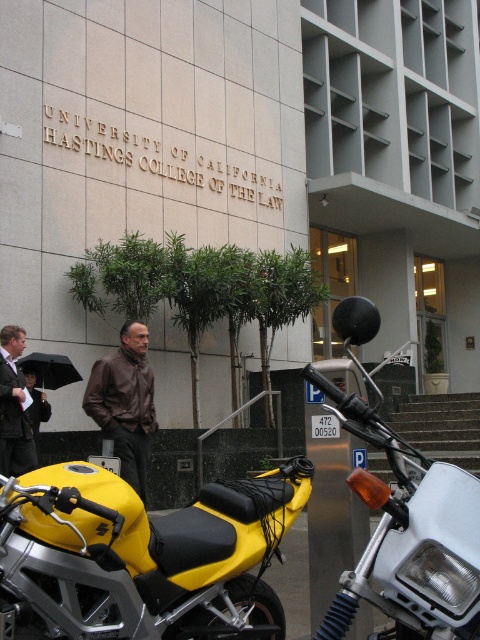
Question: In this image, where is yellow matte motorcycle at center located relative to brown leather jacket at lower left?

Choices:
 (A) left
 (B) right

Answer: (B)

Question: Which of the following is the closest to the observer?

Choices:
 (A) (143, 416)
 (B) (14, 422)
 (C) (60, 561)
 (D) (475, 618)

Answer: (D)

Question: Is yellow matte/synthetic motorbike at center thinner than yellow matte motorcycle at center?

Choices:
 (A) yes
 (B) no

Answer: (B)

Question: Does yellow matte motorcycle at center have a greater width compared to brown leather jacket at center?

Choices:
 (A) yes
 (B) no

Answer: (B)

Question: Which object is the closest to the yellow matte/synthetic motorbike at center?

Choices:
 (A) brown leather jacket at center
 (B) brown leather jacket at lower left
 (C) yellow matte motorcycle at center

Answer: (C)

Question: Which object is farther from the camera taking this photo?

Choices:
 (A) yellow matte/synthetic motorbike at center
 (B) brown leather jacket at center
 (C) yellow matte motorcycle at center

Answer: (B)